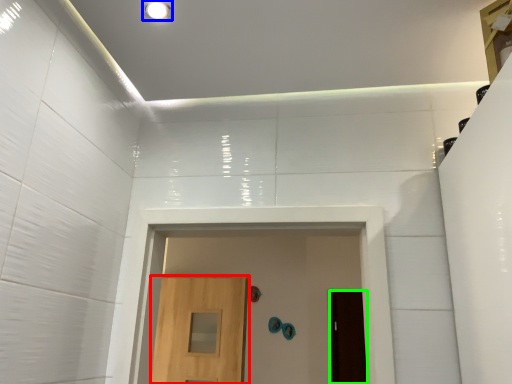
Question: Considering the real-world distances, which object is closest to door (highlighted by a red box)? lighting (highlighted by a blue box) or door (highlighted by a green box).

Choices:
 (A) lighting
 (B) door

Answer: (B)